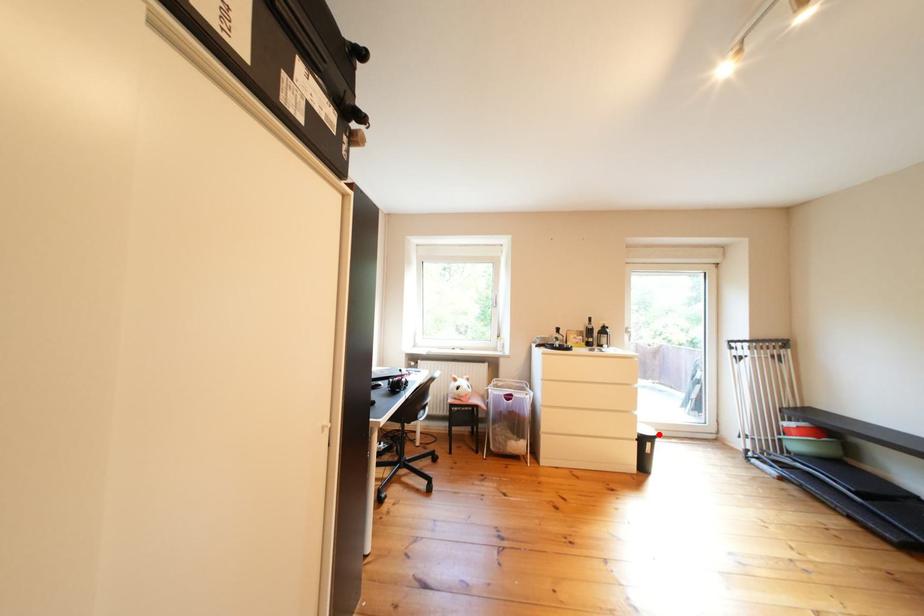
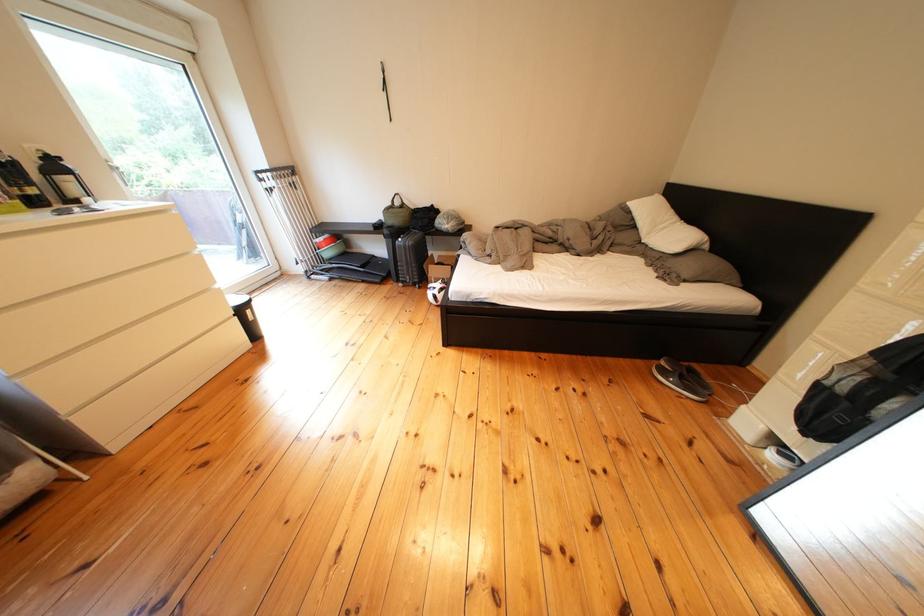
The point at the highlighted location is marked in the first image. Where is the corresponding point in the second image?

(250, 304)